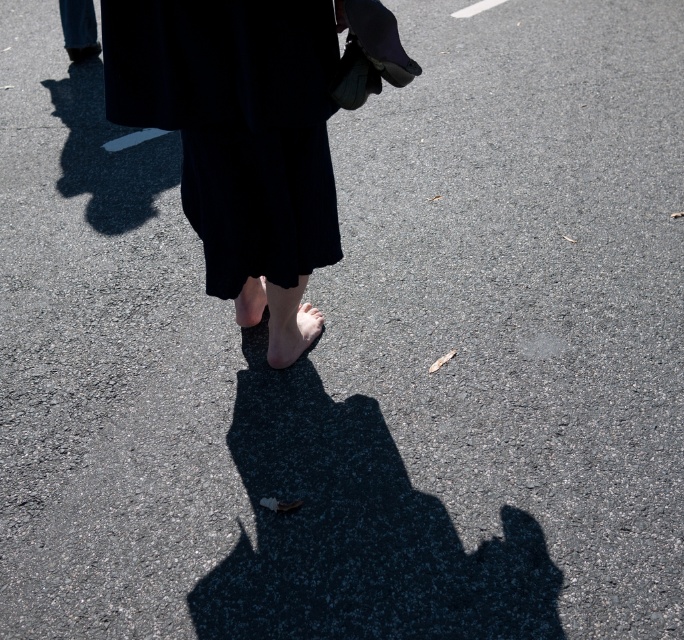
Who is more forward, (291, 337) or (263, 296)?

Positioned in front is point (291, 337).

Is barefoot at center smaller than matte skin foot at center?

Incorrect, barefoot at center is not smaller in size than matte skin foot at center.

Is point (287, 353) less distant than point (249, 276)?

No.

The height and width of the screenshot is (640, 684). What are the coordinates of `barefoot at center` in the screenshot? It's located at (289, 323).

Can you confirm if black matte dress at center is positioned to the right of barefoot at center?

In fact, black matte dress at center is to the left of barefoot at center.

Can you confirm if black matte dress at center is positioned below barefoot at center?

No, black matte dress at center is not below barefoot at center.

The image size is (684, 640). I want to click on black matte dress at center, so click(x=236, y=124).

Can you confirm if black matte dress at center is wider than matte skin foot at center?

Yes, black matte dress at center is wider than matte skin foot at center.

Does black matte dress at center appear on the right side of matte skin foot at center?

Incorrect, black matte dress at center is not on the right side of matte skin foot at center.

Find the location of `black matte dress at center`. black matte dress at center is located at coordinates (236, 124).